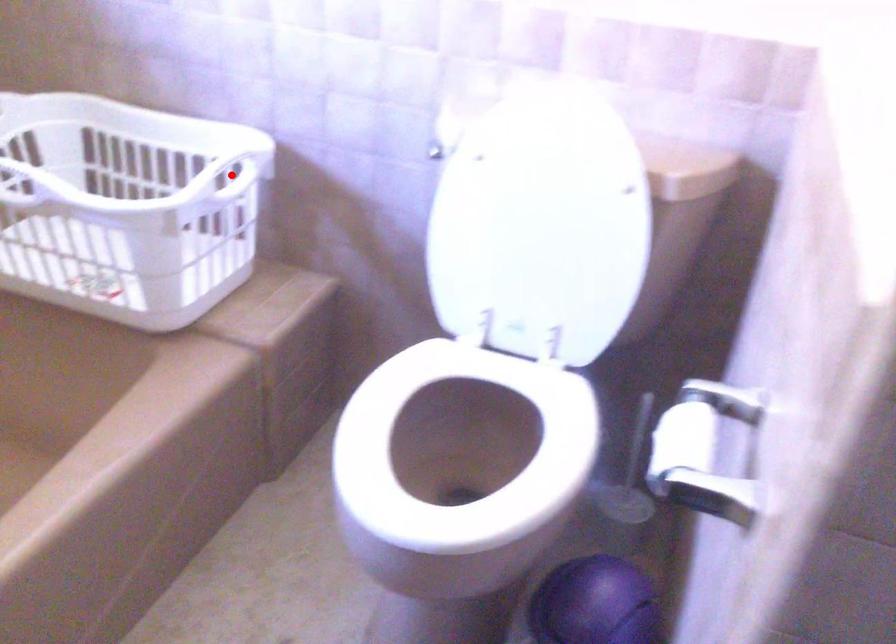
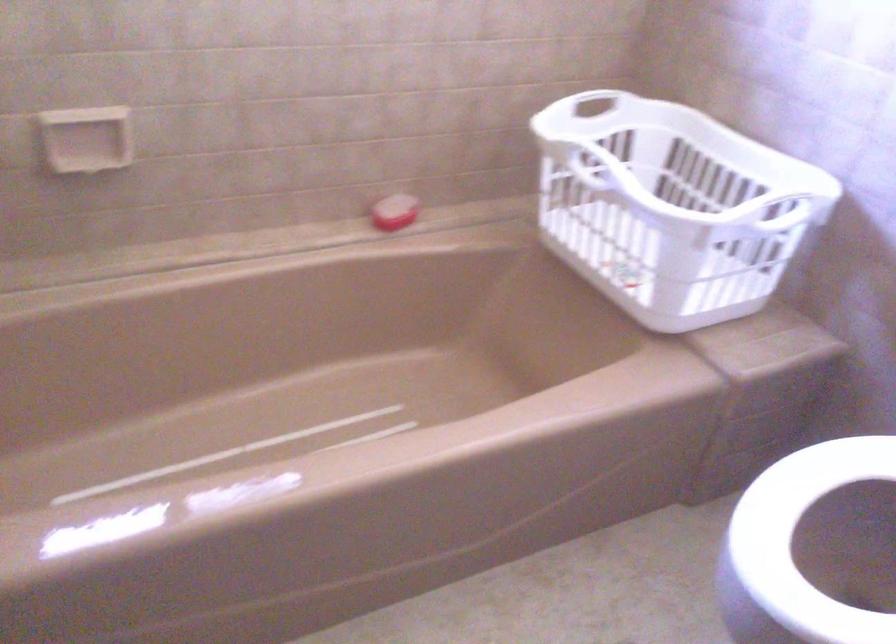
Question: I am providing you with two images of the same scene from different viewpoints. A red point is marked on the first image. Is the red point's position out of view in image 2?

Choices:
 (A) Yes
 (B) No

Answer: (B)